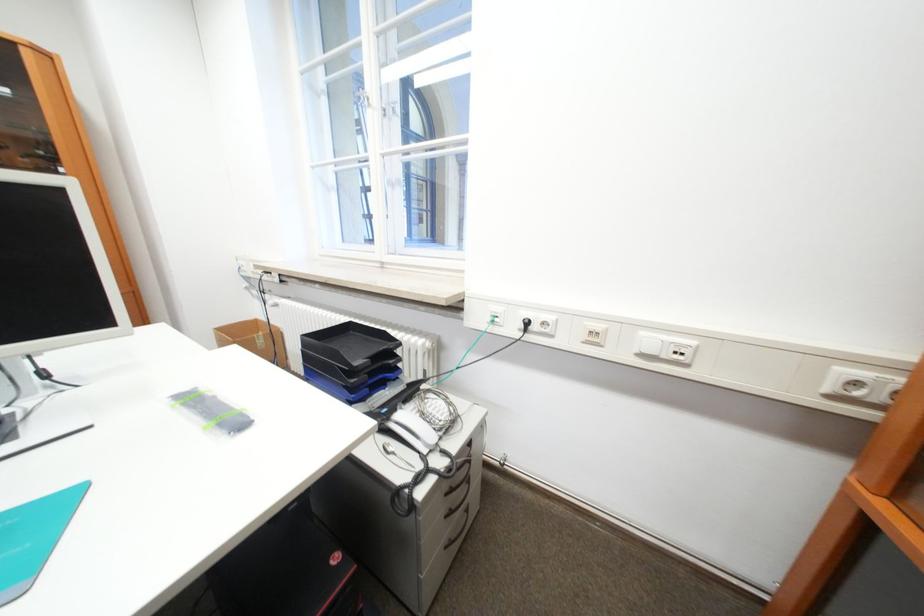
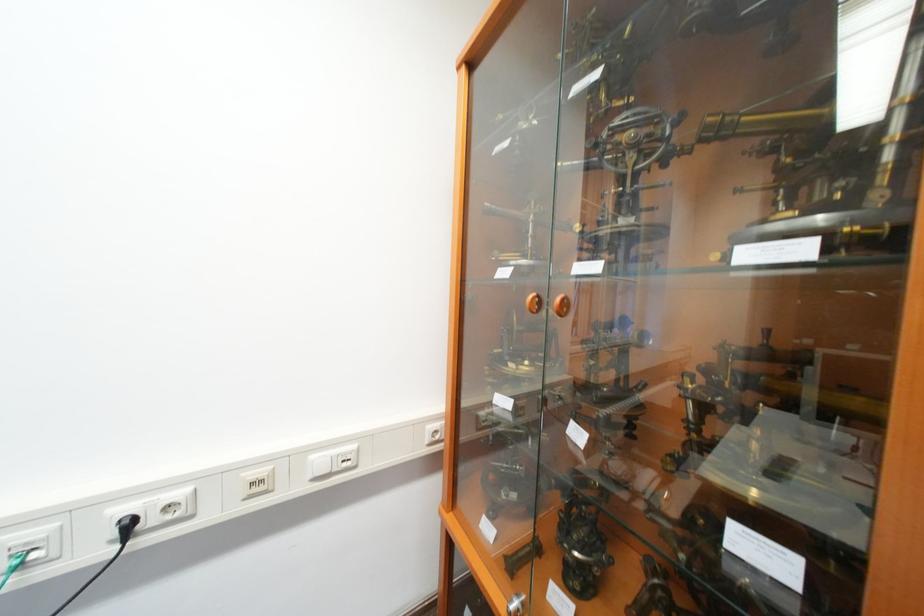
The point at (529, 331) is marked in the first image. Where is the corresponding point in the second image?

(120, 543)